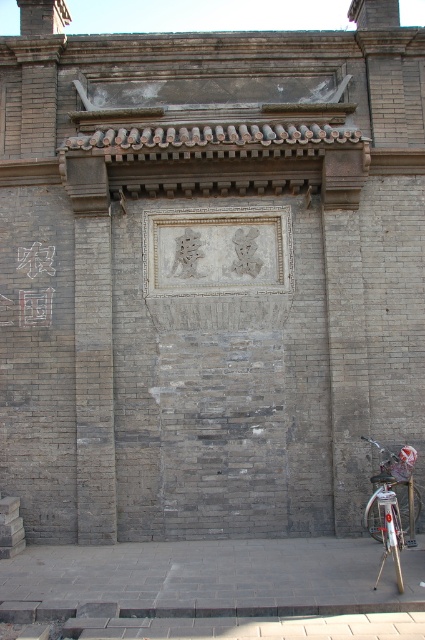
You are standing in front of the traditional Chinese architectural wall and want to place a small potted plant on the dark gray stone pavement at lower center. However, you also need to park the silver metallic bicycle at lower right nearby. Considering their heights, which object should be placed first to ensure stability?

The dark gray stone pavement at lower center is not as tall as the silver metallic bicycle at lower right, so you should place the potted plant on the dark gray stone pavement at lower center first to ensure stability.

You are a tourist standing in front of the traditional Chinese wall. You see the white stone plaque at center and the silver metallic bicycle at lower right. Which object is positioned to the left of the other?

The white stone plaque at center is to the left of the silver metallic bicycle at lower right according to the description.

You are an architect examining the traditional Chinese wall. You notice two points marked on the wall at coordinates point (232, 273) and point (380, 538). Which point is closer to you?

Point (232, 273) is further to the viewer than point (380, 538), so the closer point is point (380, 538).